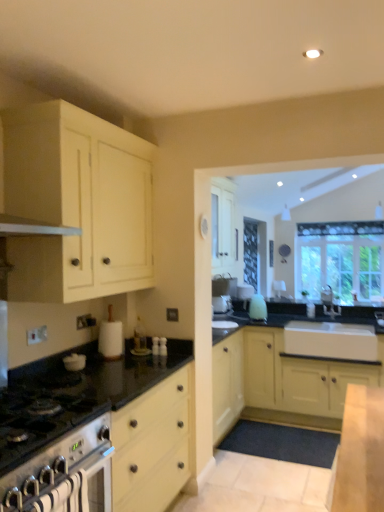
Question: Considering the relative sizes of matte cream cabinet at upper left, the first cabinetry positioned from the top, and stainless steel oven at lower left in the image provided, is matte cream cabinet at upper left, the first cabinetry positioned from the top, bigger than stainless steel oven at lower left?

Choices:
 (A) no
 (B) yes

Answer: (B)

Question: Does matte cream cabinet at upper left, the 2th cabinetry when ordered from back to front, have a greater width compared to stainless steel oven at lower left?

Choices:
 (A) yes
 (B) no

Answer: (B)

Question: Is matte cream cabinet at upper left, acting as the 1th cabinetry starting from the front, far away from stainless steel oven at lower left?

Choices:
 (A) no
 (B) yes

Answer: (B)

Question: Is matte cream cabinet at upper left, which is counted as the first cabinetry, starting from the left, not within stainless steel oven at lower left?

Choices:
 (A) yes
 (B) no

Answer: (A)

Question: Is matte cream cabinet at upper left, which is counted as the first cabinetry, starting from the left, taller than stainless steel oven at lower left?

Choices:
 (A) yes
 (B) no

Answer: (A)

Question: Considering the relative sizes of matte cream cabinet at upper left, the 2th cabinetry when ordered from back to front, and stainless steel oven at lower left in the image provided, is matte cream cabinet at upper left, the 2th cabinetry when ordered from back to front, shorter than stainless steel oven at lower left?

Choices:
 (A) yes
 (B) no

Answer: (B)

Question: Is white matte paper towel holder at center, which ranks as the second appliance in left-to-right order, behind stainless steel oven at lower left?

Choices:
 (A) no
 (B) yes

Answer: (B)

Question: Considering the relative sizes of white matte paper towel holder at center, which ranks as the second appliance in left-to-right order, and stainless steel oven at lower left in the image provided, is white matte paper towel holder at center, which ranks as the second appliance in left-to-right order, bigger than stainless steel oven at lower left?

Choices:
 (A) no
 (B) yes

Answer: (A)

Question: Is white matte paper towel holder at center, the 1th appliance in the right-to-left sequence, to the right of stainless steel oven at lower left from the viewer's perspective?

Choices:
 (A) no
 (B) yes

Answer: (B)

Question: Is white matte paper towel holder at center, which is the 2th appliance from front to back, outside stainless steel oven at lower left?

Choices:
 (A) no
 (B) yes

Answer: (B)

Question: From a real-world perspective, is white matte paper towel holder at center, which is the 2th appliance from front to back, on stainless steel oven at lower left?

Choices:
 (A) no
 (B) yes

Answer: (B)

Question: Can you confirm if white matte paper towel holder at center, positioned as the 1th appliance in back-to-front order, is positioned to the left of stainless steel oven at lower left?

Choices:
 (A) no
 (B) yes

Answer: (A)

Question: Does white glossy kettle at lower left, the 2th appliance when ordered from right to left, have a greater height compared to clear glass window at upper right?

Choices:
 (A) no
 (B) yes

Answer: (A)